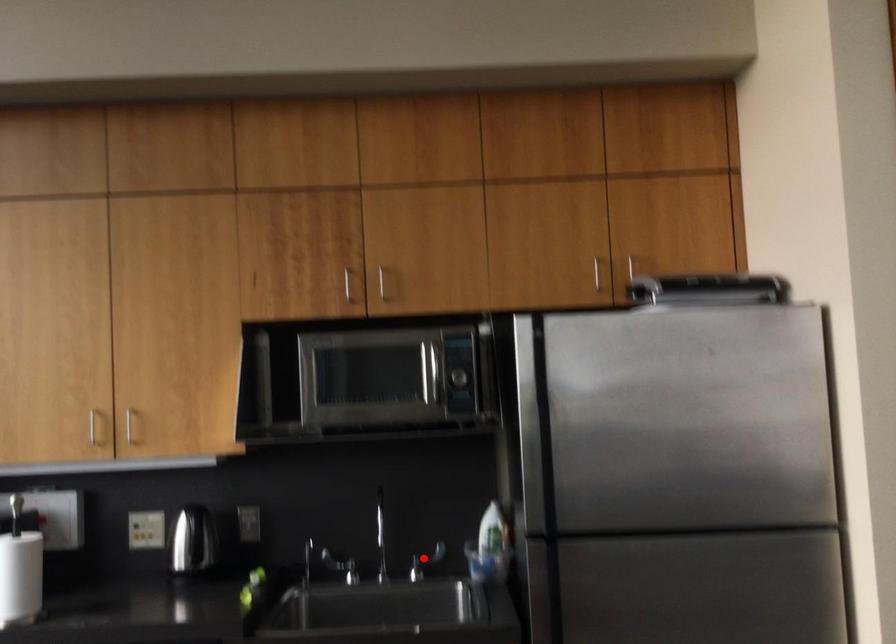
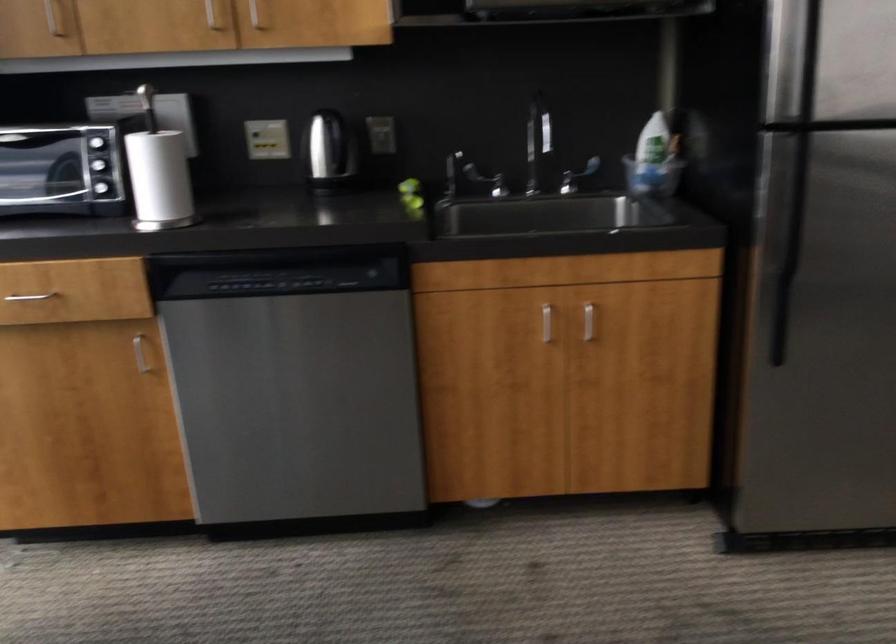
Find the pixel in the second image that matches the highlighted location in the first image.

(576, 176)